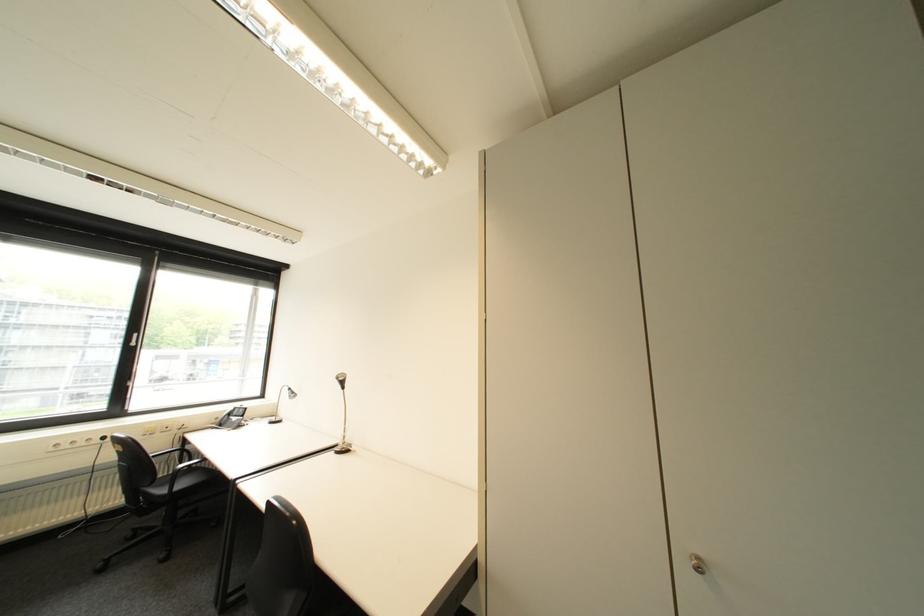
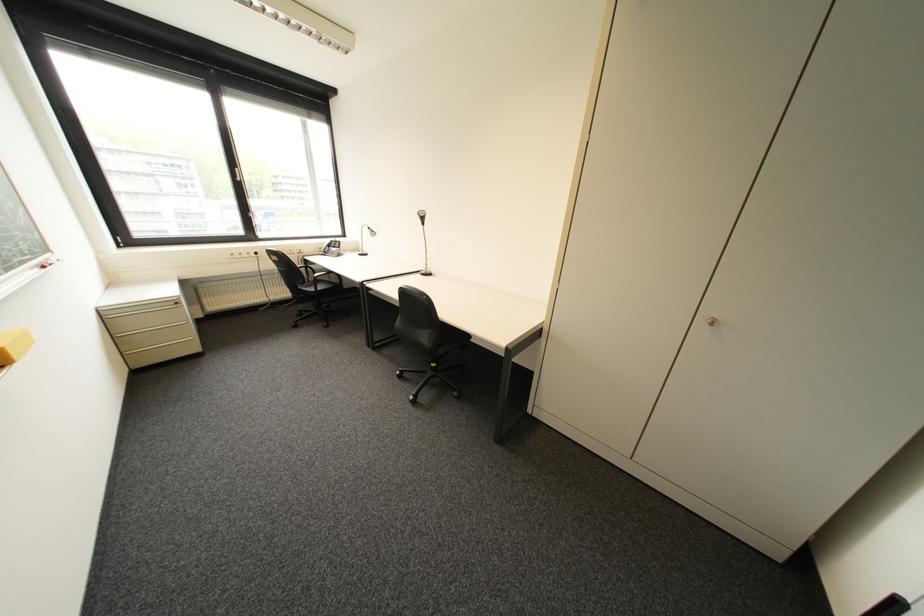
In the second image, find the point that corresponds to [237,411] in the first image.

(335, 244)